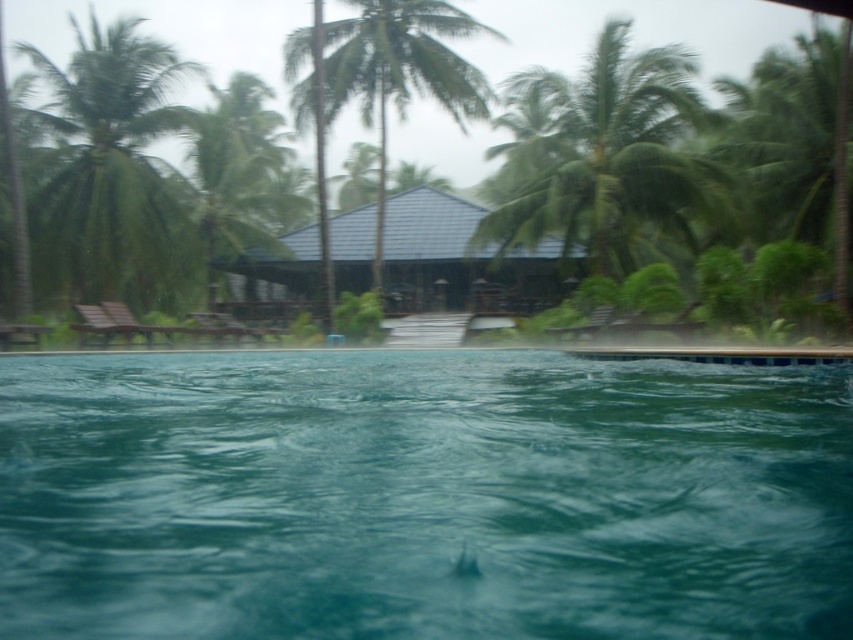
You are a guest at the resort and want to take a photo of the green glossy pool at center and the green leafy palm tree at upper right. Which object should you focus on first to ensure both are in the frame?

The green glossy pool at center is in front of the green leafy palm tree at upper right, so you should focus on the green glossy pool at center first to ensure both are in the frame.

You are planning to take a photo of the green glossy pool at center and the green leafy palm tree at upper right. Which object should you focus on first if you want to capture both in the frame without moving the camera?

The green glossy pool at center is wider than the green leafy palm tree at upper right, so you should focus on the pool first to ensure it fits within the frame.

You are standing at the edge of the pool and want to walk to the pavilion. Which palm tree should you pass between the green leafy palm tree at left and the green leafy palm tree at center?

You should pass between the green leafy palm tree at left and the green leafy palm tree at center. Since the green leafy palm tree at left is to the left of the green leafy palm tree at center, you would walk between them towards the pavilion.